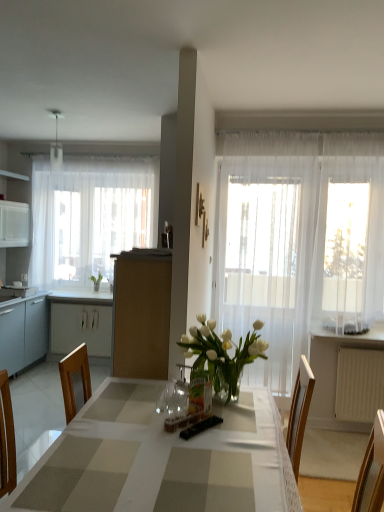
Where is `vacant space situated on the left part of translucent glass vase at center`? vacant space situated on the left part of translucent glass vase at center is located at coordinates (155, 412).